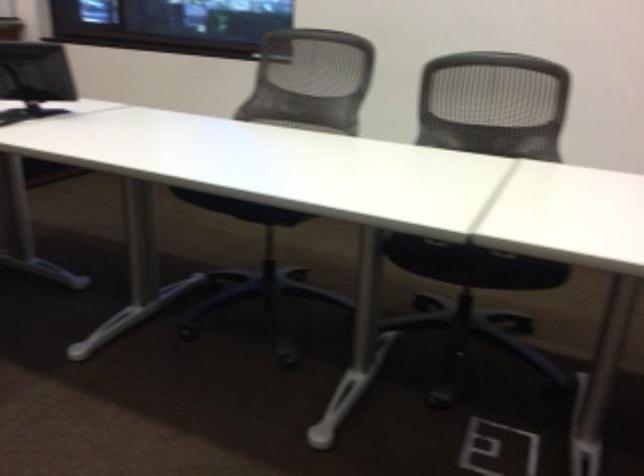
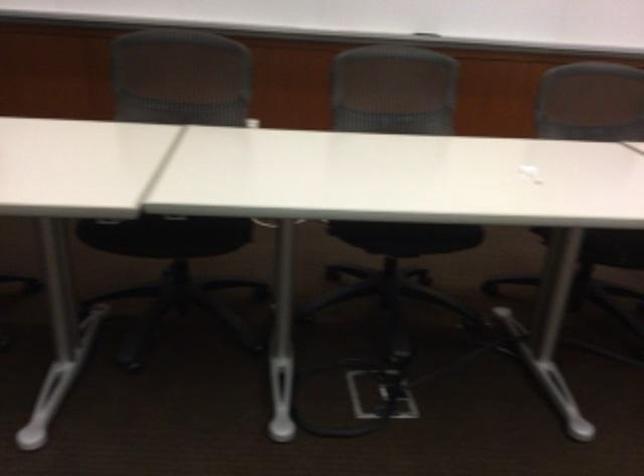
Question: Based on the continuous images, in which direction is the camera rotating? Reply with the corresponding letter.

Choices:
 (A) Left
 (B) Right
 (C) Up
 (D) Down

Answer: (A)